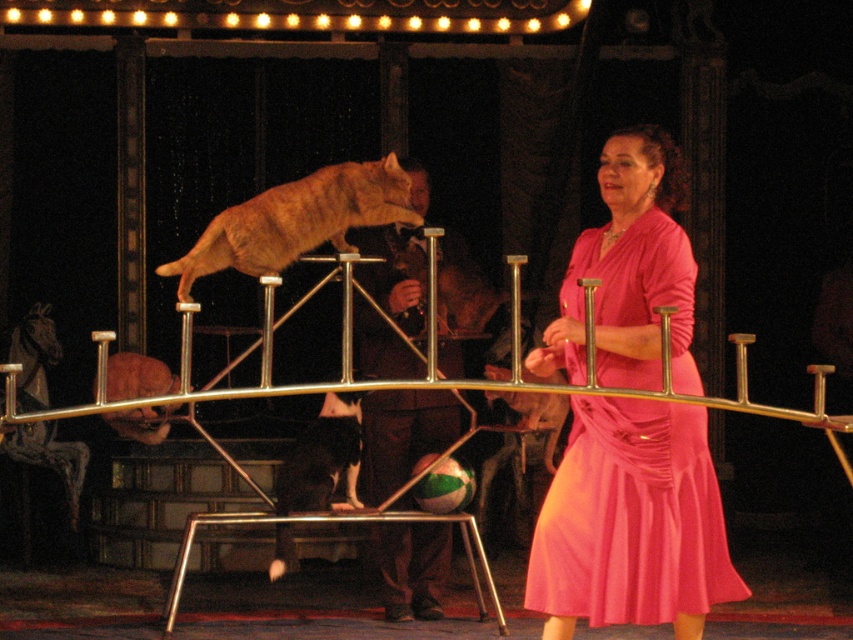
Who is positioned more to the right, pink satin dress at center or orange fur cat at center?

pink satin dress at center

Is point (637, 513) farther from viewer compared to point (277, 204)?

No, (637, 513) is in front of (277, 204).

Where is `pink satin dress at center`? This screenshot has width=853, height=640. pink satin dress at center is located at coordinates (631, 522).

Is point (393, 570) in front of point (328, 173)?

No, (393, 570) is behind (328, 173).

Can you confirm if smooth leather glove at center is positioned to the left of orange fur cat at center?

In fact, smooth leather glove at center is to the right of orange fur cat at center.

Is point (426, 390) positioned after point (345, 212)?

Yes, point (426, 390) is farther from viewer.

You are a GUI agent. You are given a task and a screenshot of the screen. Output one action in this format:
    pyautogui.click(x=<x>, y=<y>)
    Task: Click on the smooth leather glove at center
    
    Given the screenshot: What is the action you would take?
    pyautogui.click(x=404, y=433)

Does pink satin dress at center have a greater height compared to smooth leather glove at center?

Yes.

Between pink satin dress at center and smooth leather glove at center, which one is positioned higher?

smooth leather glove at center

Is point (619, 186) positioned behind point (450, 552)?

No, it is not.

Locate an element on the screen. This screenshot has height=640, width=853. pink satin dress at center is located at coordinates 631,522.